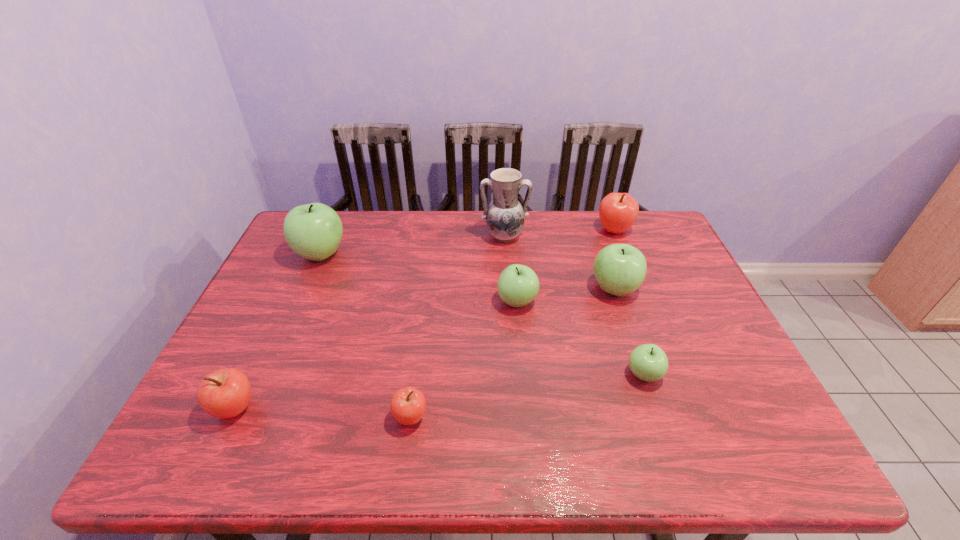
Locate an element on the screen. This screenshot has width=960, height=540. the smallest pink apple is located at coordinates (408, 404).

The image size is (960, 540). I want to click on the second pink apple from right to left, so click(408, 404).

In order to click on free space located on either side of the tallest object in this screenshot , I will do `click(510, 315)`.

The height and width of the screenshot is (540, 960). I want to click on vacant space located on the right of the leftmost green apple, so click(x=455, y=254).

In order to click on vacant area situated on the front of the biggest pink apple in this screenshot , I will do pos(648,316).

The width and height of the screenshot is (960, 540). In order to click on vacant area located on the front of the third smallest green apple in this screenshot , I will do `click(640, 364)`.

Locate an element on the screen. The height and width of the screenshot is (540, 960). vacant space located on the left of the fourth apple from right to left is located at coordinates (378, 301).

Image resolution: width=960 pixels, height=540 pixels. I want to click on vacant position located 0.210m on the back of the second smallest pink apple, so click(x=276, y=322).

The width and height of the screenshot is (960, 540). In order to click on vacant region located on the right of the nearest green apple in this screenshot , I will do `click(705, 375)`.

The image size is (960, 540). Identify the location of vacant space located 0.070m on the right of the smallest pink apple. (460, 417).